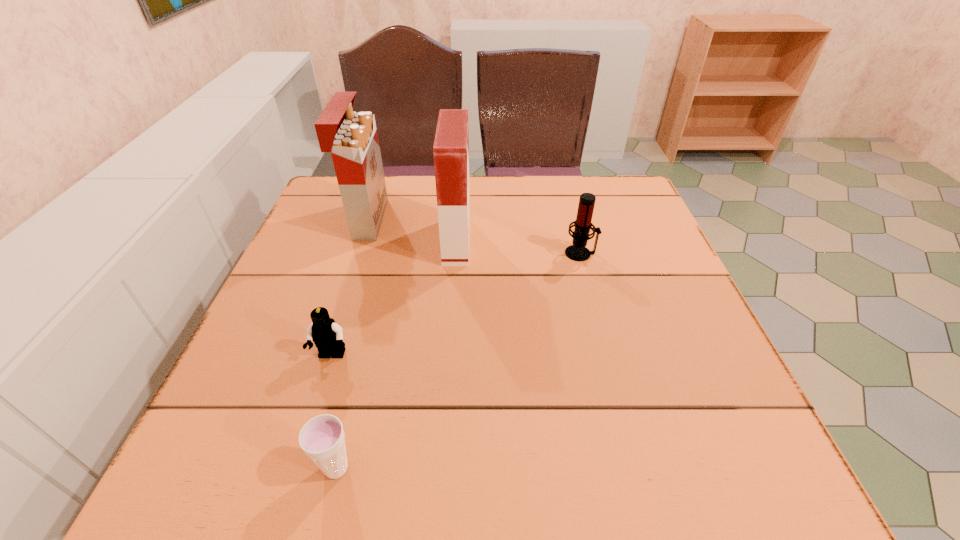
Identify the location of free space at the far right corner of the desktop. (579, 184).

At what (x,y) coordinates should I click in order to perform the action: click on unoccupied position between the right cigarette_case and the microphone. Please return your answer as a coordinate pair (x, y). Looking at the image, I should click on (518, 247).

I want to click on empty space between the cup and the left cigarette_case, so click(x=351, y=344).

This screenshot has width=960, height=540. Identify the location of free space between the left cigarette_case and the third tallest object. (473, 237).

You are a GUI agent. You are given a task and a screenshot of the screen. Output one action in this format:
    pyautogui.click(x=<x>, y=<y>)
    Task: Click on the free spot between the right cigarette_case and the left cigarette_case
    This screenshot has height=540, width=960.
    Given the screenshot: What is the action you would take?
    point(412,231)

This screenshot has width=960, height=540. In order to click on free area in between the Lego and the fourth object from left to right in this screenshot , I will do `click(395, 299)`.

Image resolution: width=960 pixels, height=540 pixels. I want to click on free point between the Lego and the second object from right to left, so click(395, 299).

You are a GUI agent. You are given a task and a screenshot of the screen. Output one action in this format:
    pyautogui.click(x=<x>, y=<y>)
    Task: Click on the free area in between the left cigarette_case and the Lego
    The width and height of the screenshot is (960, 540).
    Given the screenshot: What is the action you would take?
    pyautogui.click(x=349, y=288)

Image resolution: width=960 pixels, height=540 pixels. I want to click on free space between the left cigarette_case and the second nearest object, so click(x=349, y=288).

This screenshot has width=960, height=540. Identify the location of free area in between the left cigarette_case and the third shortest object. (473, 237).